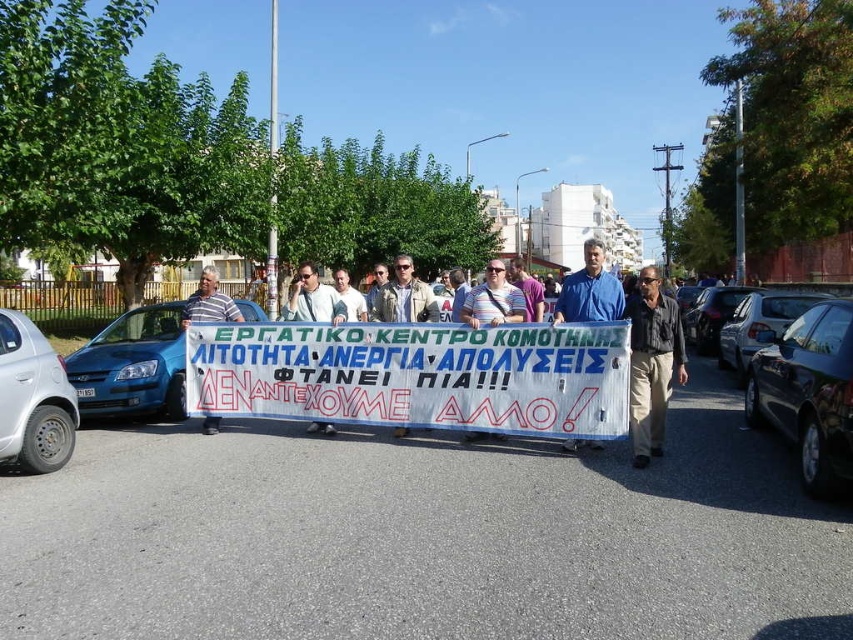
Which of these two, blue metallic car at left or matte white banner at center, stands shorter?

Standing shorter between the two is blue metallic car at left.

Who is higher up, blue metallic car at left or matte white banner at center?

matte white banner at center

Is point (96, 396) less distant than point (328, 316)?

No, (96, 396) is behind (328, 316).

At what (x,y) coordinates should I click in order to perform the action: click on blue metallic car at left. Please return your answer as a coordinate pair (x, y). Looking at the image, I should click on (132, 365).

Does shiny black car at right have a lesser width compared to white paper banner at center?

Correct, shiny black car at right's width is less than white paper banner at center's.

Which is in front, point (767, 342) or point (200, 276)?

Point (767, 342) is in front.

Is point (793, 298) less distant than point (204, 304)?

No.

Where is `shiny black car at right`? This screenshot has width=853, height=640. shiny black car at right is located at coordinates (759, 324).

Does black glossy car at right appear over white plastic sign at center?

Actually, black glossy car at right is below white plastic sign at center.

Based on the photo, can you confirm if black glossy car at right is taller than white plastic sign at center?

In fact, black glossy car at right may be shorter than white plastic sign at center.

Identify the location of black glossy car at right. (808, 394).